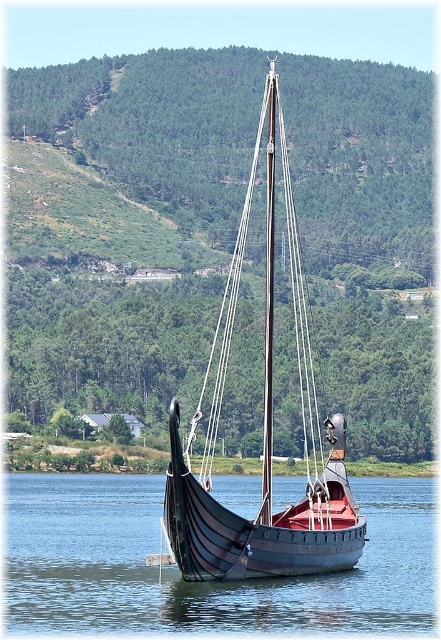
You are a sailor trying to navigate your black wood sailboat at center to the right side of the image. According to the scene, will the smooth blue water at center help you move towards the right?

The smooth blue water at center is to the left of black wood sailboat at center, so the water is positioned to the left of the sailboat. To navigate to the right side, the sailor would need to maneuver around or past the water on the left side. However, since the water is at the center, there might be other areas of water not mentioned that could allow movement to the right. The provided information does not specify the full layout beyond the center, so it is unclear if the smooth blue water at center alone